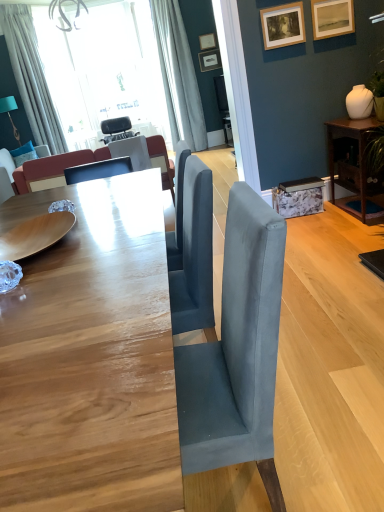
Question: Is point (213, 36) positioned closer to the camera than point (196, 87)?

Choices:
 (A) closer
 (B) farther

Answer: (A)

Question: Choose the correct answer: Is matte white picture frame at upper center, acting as the first picture frame starting from the top, inside white fabric curtain at upper center, which ranks as the 2th curtain in left-to-right order, or outside it?

Choices:
 (A) outside
 (B) inside

Answer: (A)

Question: Considering the real-world distances, which object is closest to the white fabric curtain at upper center, the first curtain from the right?

Choices:
 (A) matte white picture frame at upper center, acting as the first picture frame starting from the top
 (B) velvet fabric couch at left, arranged as the first couch when viewed from the back
 (C) brown wood table at right, marked as the 1th table in a right-to-left arrangement
 (D) matte black chair at center, which appears as the second chair when viewed from the top
 (E) smooth wooden table at center, the first table viewed from the left

Answer: (A)

Question: Based on their relative distances, which object is farther from the matte wooden picture frame at upper right, which is counted as the 2th picture frame, starting from the front?

Choices:
 (A) white fabric curtain at upper left, positioned as the 2th curtain in right-to-left order
 (B) matte white picture frame at upper center, acting as the third picture frame starting from the front
 (C) velvet fabric couch at left, arranged as the first couch when viewed from the back
 (D) brown wood table at right, marked as the 1th table in a right-to-left arrangement
 (E) matte black chair at center, arranged as the 1th chair when viewed from the right

Answer: (A)